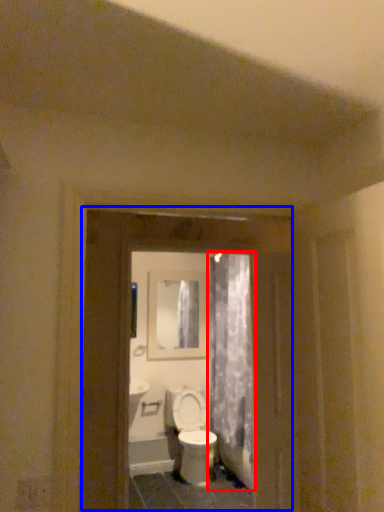
Question: Which object appears closest to the camera in this image, shower curtain (highlighted by a red box) or screen door (highlighted by a blue box)?

Choices:
 (A) shower curtain
 (B) screen door

Answer: (B)